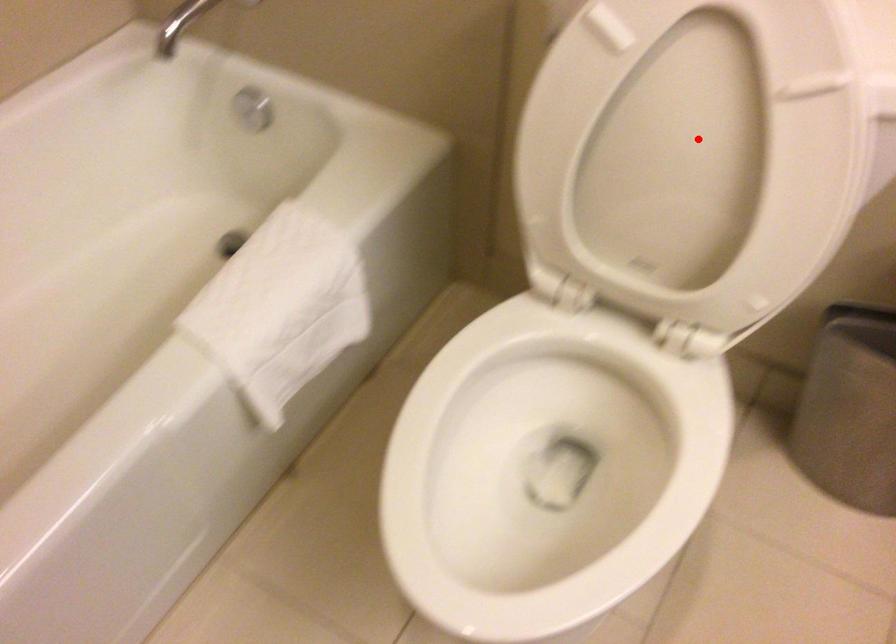
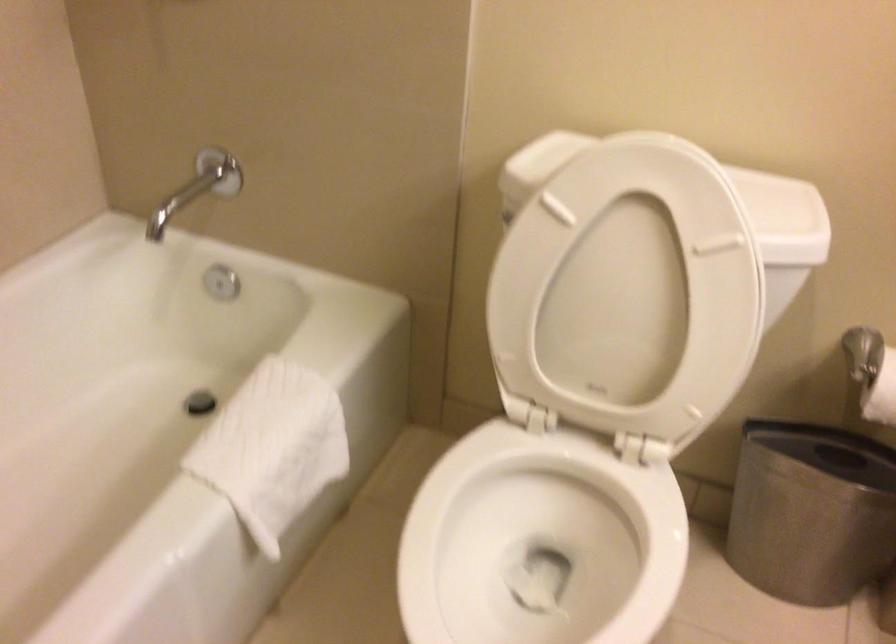
Question: I am providing you with two images of the same scene from different viewpoints. Image1 has a red point marked. In image2, the corresponding 3D location appears at what relative position? Reply with the corresponding letter.

Choices:
 (A) Closer
 (B) Farther

Answer: (B)